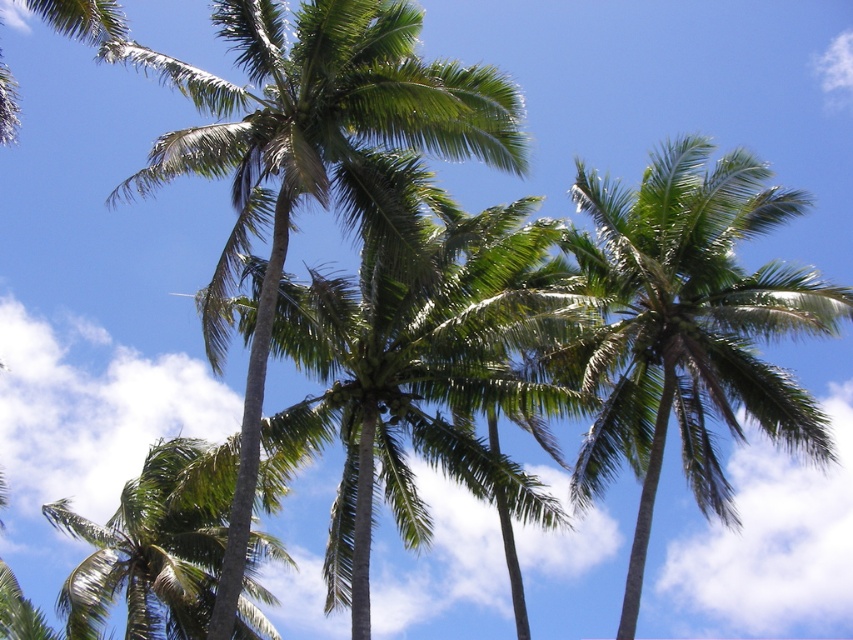
Question: Is green leafy palm tree at upper right thinner than green leafy palm tree at center?

Choices:
 (A) no
 (B) yes

Answer: (B)

Question: Which point is closer to the camera taking this photo?

Choices:
 (A) (209, 161)
 (B) (793, 292)

Answer: (A)

Question: Does green leafy palm tree at upper right have a greater width compared to green leafy palm tree at center?

Choices:
 (A) no
 (B) yes

Answer: (A)

Question: Does green leafy palm tree at upper right have a larger size compared to green leafy palm tree at center?

Choices:
 (A) no
 (B) yes

Answer: (A)

Question: Which point is closer to the camera?

Choices:
 (A) (701, 291)
 (B) (514, 163)

Answer: (B)